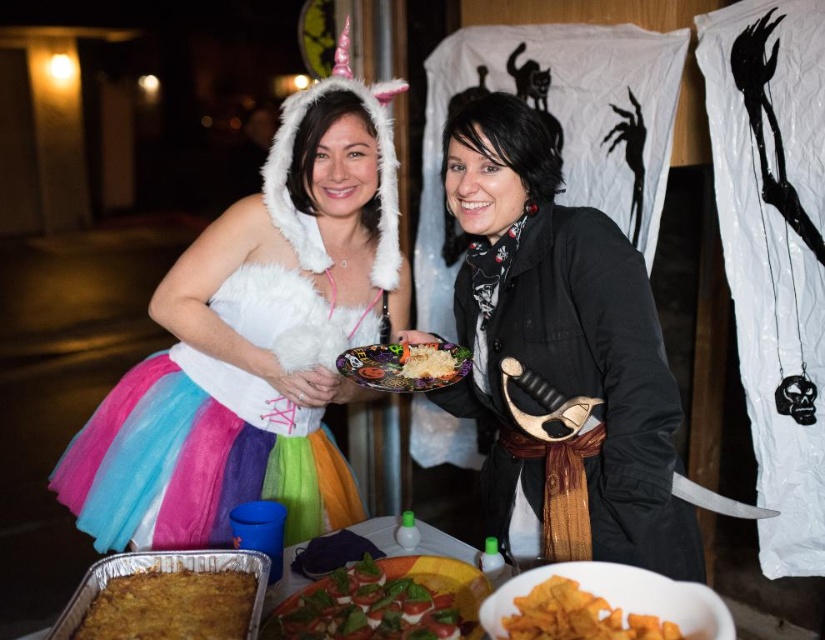
Question: Is multicolored tulle skirt at center bigger than matte plastic plate at center?

Choices:
 (A) yes
 (B) no

Answer: (A)

Question: Is white fluffy unicorn costume at center thinner than fresh tomato salad at center?

Choices:
 (A) yes
 (B) no

Answer: (B)

Question: Which is nearer to the white fluffy rice at center?

Choices:
 (A) white fluffy unicorn costume at center
 (B) multicolored tulle skirt at center
 (C) wooden sword at center
 (D) fresh tomato salad at center

Answer: (C)

Question: Based on their relative distances, which object is nearer to the matte plastic plate at center?

Choices:
 (A) white fluffy unicorn costume at center
 (B) multicolored tulle skirt at center
 (C) golden crispy chips at lower center
 (D) golden brown baked dish at lower left

Answer: (A)

Question: Among these objects, which one is nearest to the camera?

Choices:
 (A) white fluffy unicorn costume at center
 (B) white fluffy rice at center
 (C) golden crispy chips at lower center
 (D) golden brown baked dish at lower left

Answer: (C)

Question: From the image, what is the correct spatial relationship of fresh tomato salad at center in relation to white fluffy rice at center?

Choices:
 (A) left
 (B) right

Answer: (A)